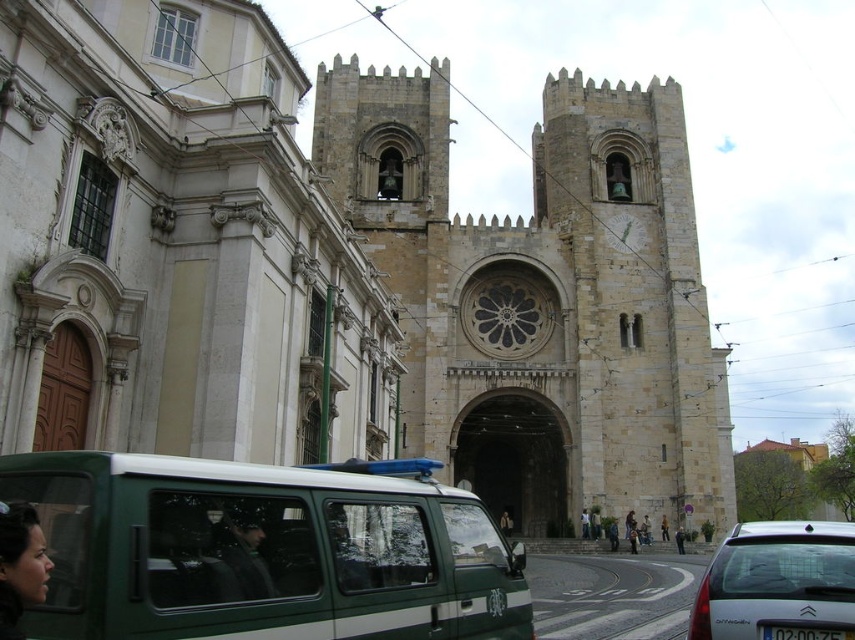
Does beige stone church at center appear over green matte van at center?

Yes, beige stone church at center is above green matte van at center.

How much distance is there between beige stone church at center and green matte van at center?

The distance of beige stone church at center from green matte van at center is 107.12 feet.

Where is `beige stone church at center`? beige stone church at center is located at coordinates pyautogui.click(x=346, y=269).

You are a GUI agent. You are given a task and a screenshot of the screen. Output one action in this format:
    pyautogui.click(x=<x>, y=<y>)
    Task: Click on the beige stone church at center
    This screenshot has width=855, height=640.
    Given the screenshot: What is the action you would take?
    pyautogui.click(x=346, y=269)

Which is behind, point (673, 250) or point (736, 538)?

The point (673, 250) is behind.

Does point (431, 268) come in front of point (724, 593)?

No, (431, 268) is further to viewer.

Locate an element on the screen. This screenshot has width=855, height=640. beige stone church at center is located at coordinates (346, 269).

You are a GUI agent. You are given a task and a screenshot of the screen. Output one action in this format:
    pyautogui.click(x=<x>, y=<y>)
    Task: Click on the beige stone church at center
    This screenshot has width=855, height=640.
    Given the screenshot: What is the action you would take?
    pyautogui.click(x=346, y=269)

Does green matte van at center have a greater width compared to white glossy car at lower right?

No, green matte van at center is not wider than white glossy car at lower right.

Is green matte van at center to the left of white glossy car at lower right from the viewer's perspective?

Correct, you'll find green matte van at center to the left of white glossy car at lower right.

The image size is (855, 640). I want to click on green matte van at center, so click(x=264, y=550).